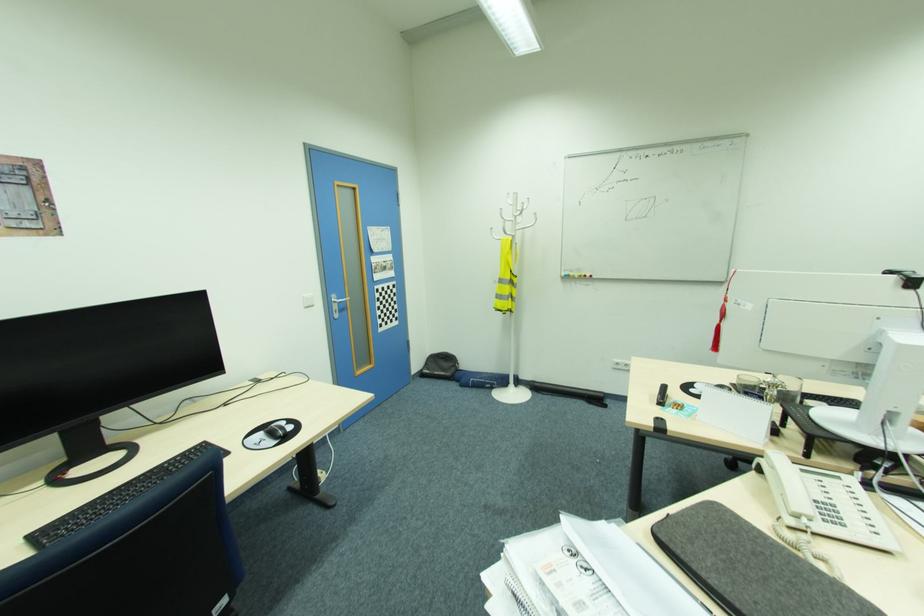
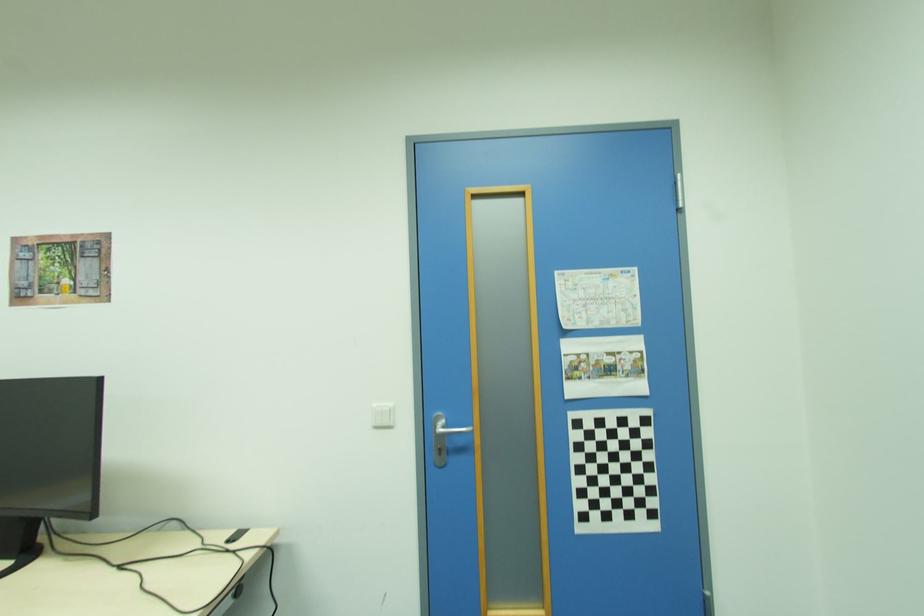
Where in the second image is the point corresponding to (337,302) from the first image?

(439, 429)